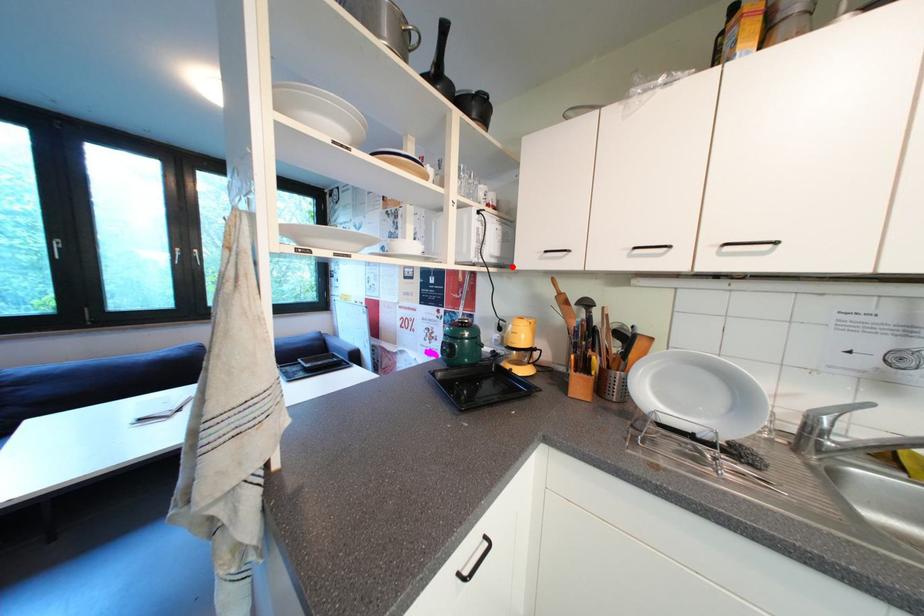
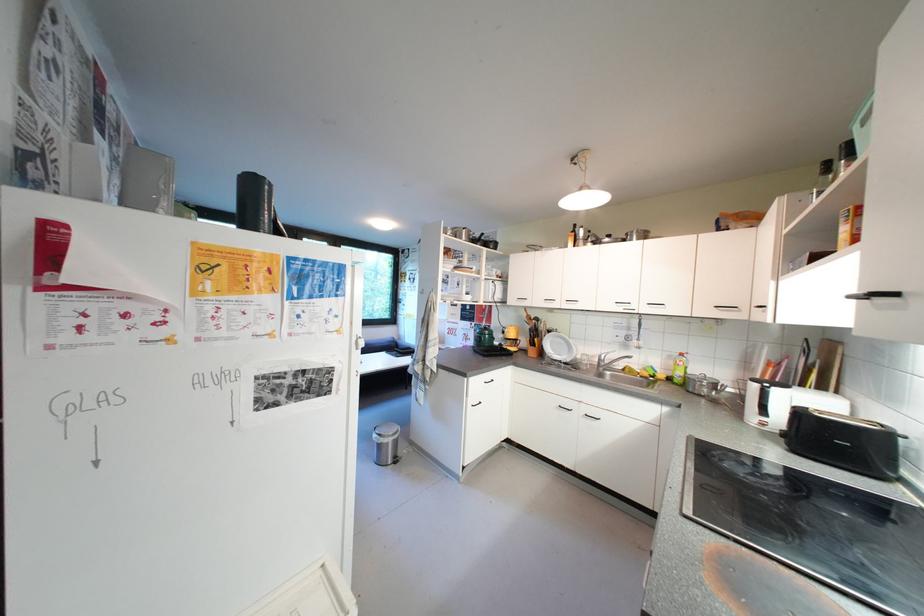
Locate, in the second image, the point that corresponds to the highlighted location in the first image.

(512, 304)